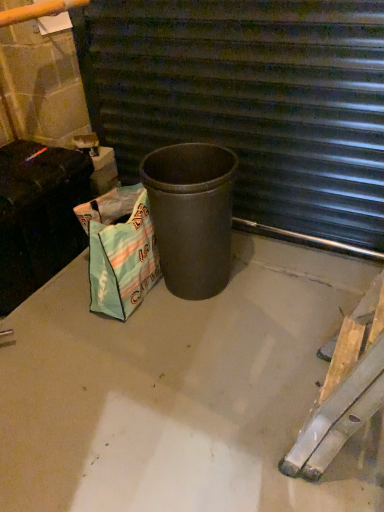
Where is `blank space above smooth concrete at center (from a real-world perspective)`? blank space above smooth concrete at center (from a real-world perspective) is located at coordinates (164, 356).